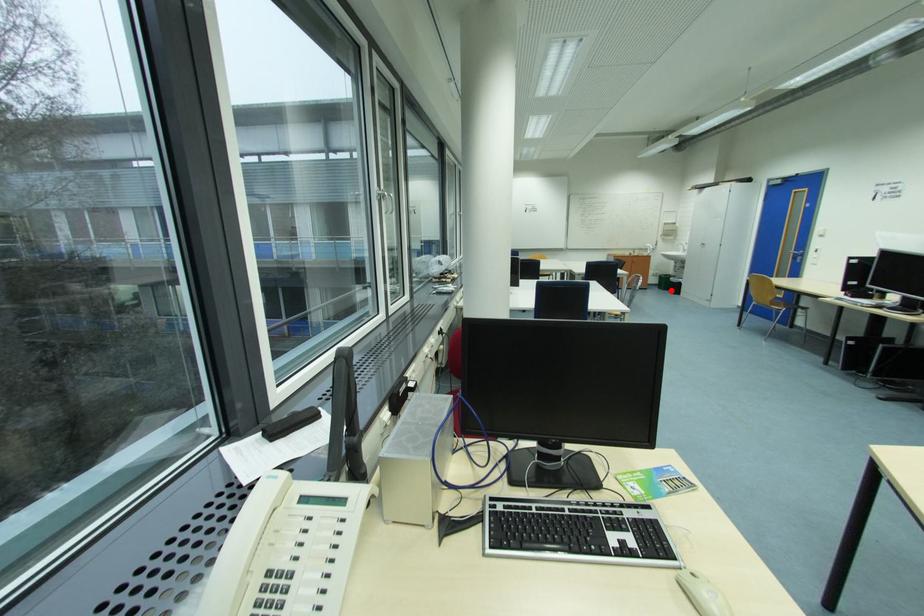
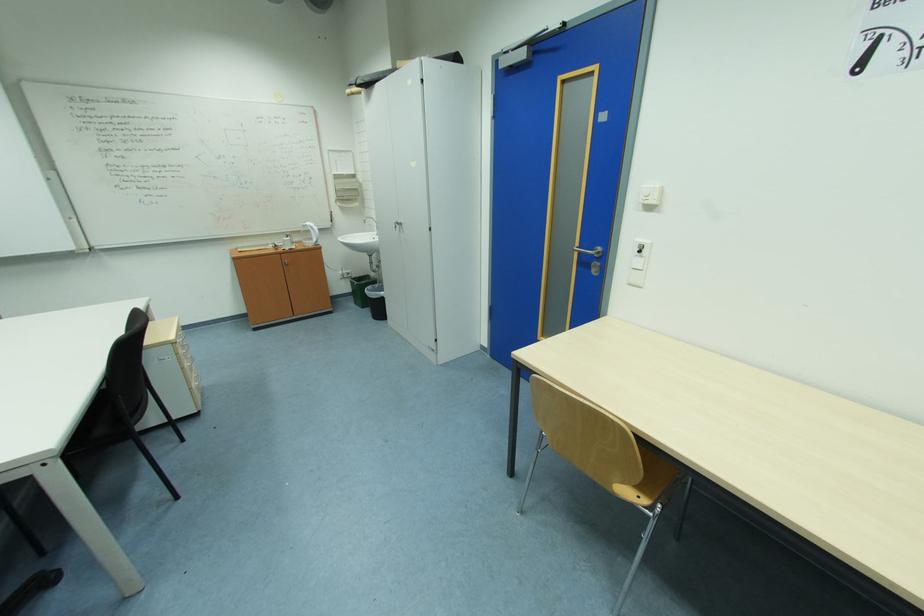
Where in the second image is the point corresponding to the highlighted location from the first image?

(370, 309)